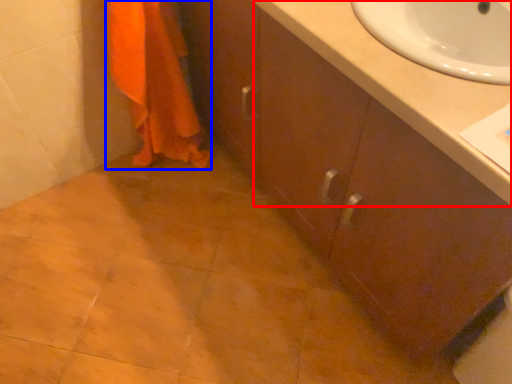
Question: Which object is further to the camera taking this photo, counter top (highlighted by a red box) or bath towel (highlighted by a blue box)?

Choices:
 (A) counter top
 (B) bath towel

Answer: (B)